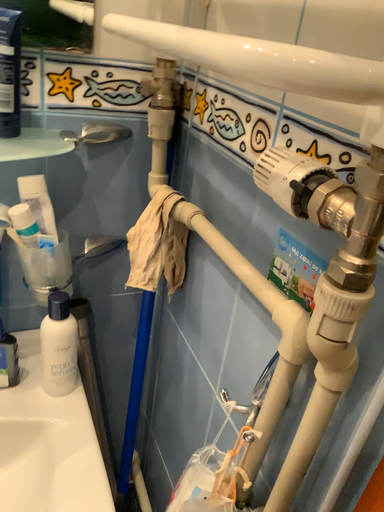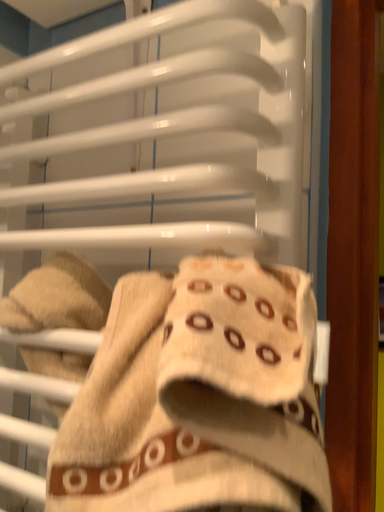
Question: How did the camera likely rotate when shooting the video?

Choices:
 (A) rotated downward
 (B) rotated upward

Answer: (B)